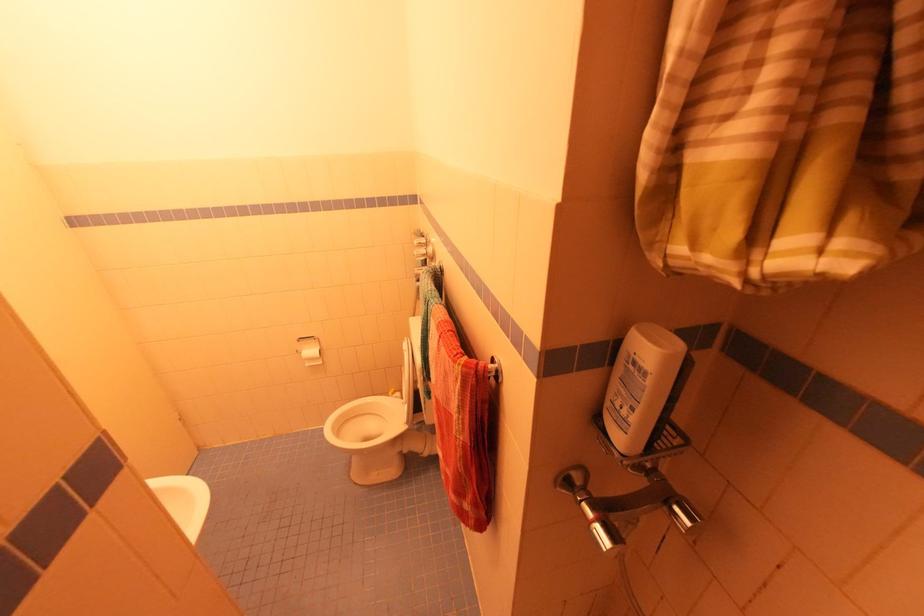
The width and height of the screenshot is (924, 616). In order to click on white toilet lid in this screenshot , I will do `click(184, 501)`.